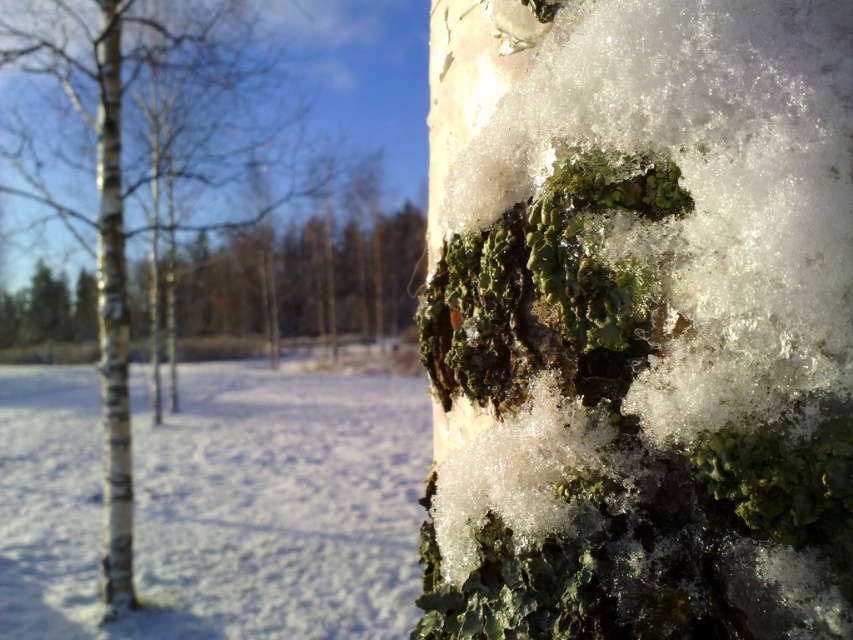
You are an artist sketching the winter scene and need to place the white matte bark at center accurately. According to the coordinates provided, where should you position it on your drawing canvas?

The white matte bark at center should be positioned at coordinates point (129, 161), as specified in the description.

You are an artist sketching this winter scene. You need to decide which object to draw first based on their sizes. Which one is wider between the white matte bark at center and the white bark tree trunk at left?

The white matte bark at center is wider than the white bark tree trunk at left, so you should draw the white matte bark at center first to capture its larger size in your sketch.

You are an artist trying to paint the winter scene. You want to ensure the white bark tree trunk at left and the white matte bark at center are positioned correctly. Based on their spatial relationship, which one should appear closer to you in your painting?

The white matte bark at center should appear closer to you in your painting because the white bark tree trunk at left is behind it, indicating that the white matte bark at center is in the foreground.